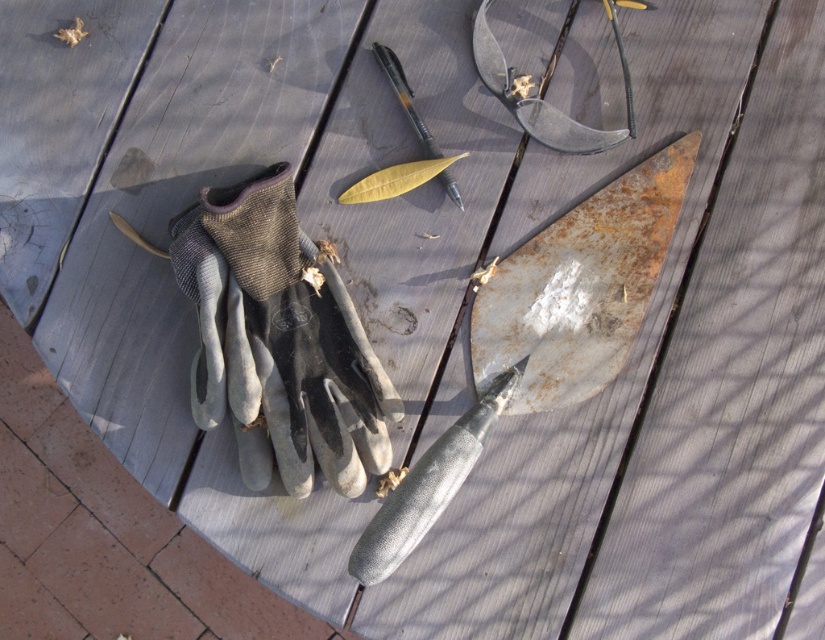
Question: Where is rusty metal blade at upper right located in relation to matte black pen at center in the image?

Choices:
 (A) above
 (B) below

Answer: (B)

Question: Which object is positioned closest to the matte black pen at center?

Choices:
 (A) rusty metal shovel at center
 (B) gray fabric glove at center
 (C) rusty metal blade at upper right

Answer: (C)

Question: Which object is positioned farthest from the rusty metal blade at upper right?

Choices:
 (A) rusty metal shovel at center
 (B) matte black pen at center
 (C) gray fabric glove at center

Answer: (C)

Question: Which point appears closest to the camera in this image?

Choices:
 (A) (534, 275)
 (B) (335, 458)

Answer: (B)

Question: Can you confirm if rusty metal blade at upper right is positioned above matte black pen at center?

Choices:
 (A) no
 (B) yes

Answer: (A)

Question: Observing the image, what is the correct spatial positioning of rusty metal shovel at center in reference to matte black pen at center?

Choices:
 (A) above
 (B) below

Answer: (B)